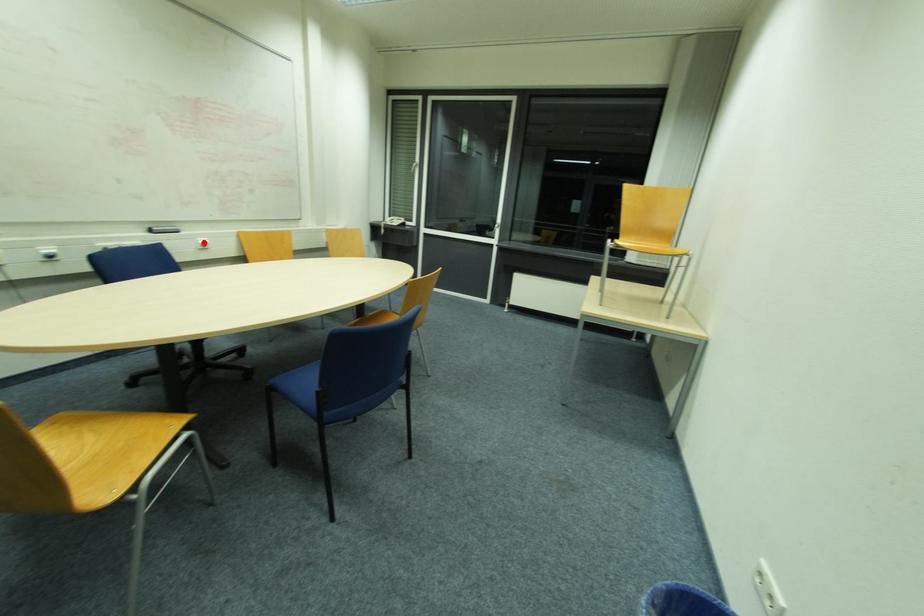
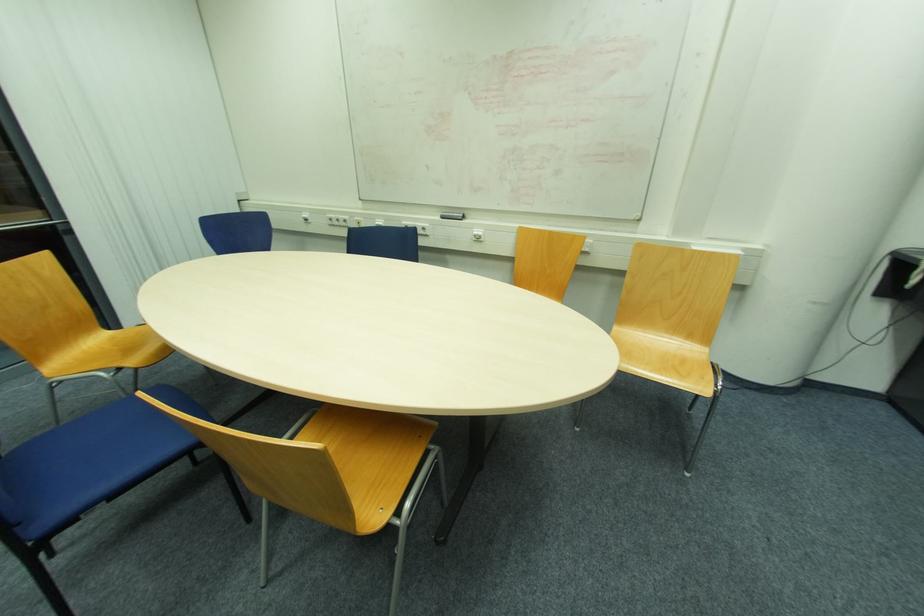
The point at the highlighted location is marked in the first image. Where is the corresponding point in the second image?

(477, 233)